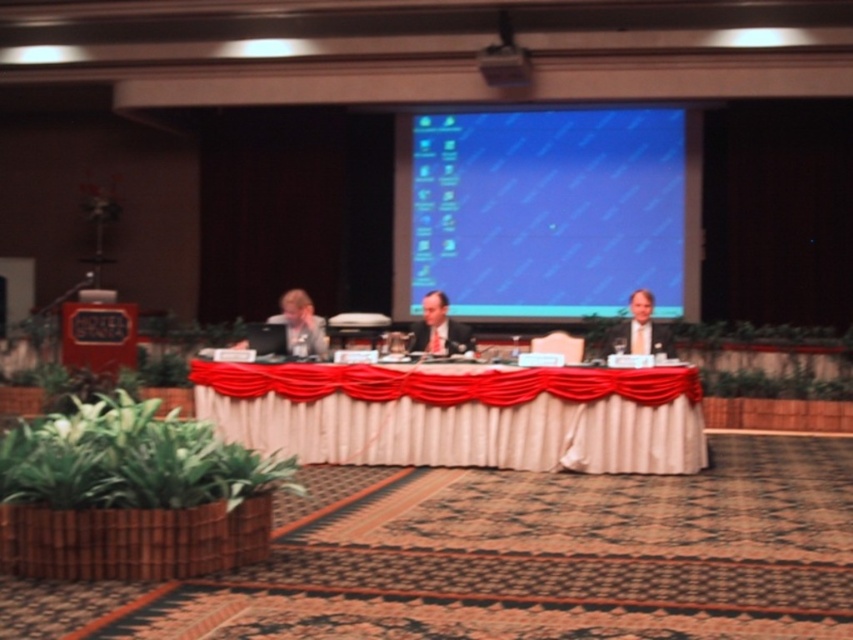
You are organizing a conference and need to place a 1.2 meter wide banner between the white satin table at center and the matte gray suit at left. Can the banner fit in the space between them based on their sizes?

The white satin table at center is wider than the matte gray suit at left. However, the banner requires 1.2 meters of space. Since the exact distance between them isn

You are an attendee at this conference and want to take a photo of the light brown hair at center without including the white satin table at center in the frame. Is this possible given their positions?

The white satin table at center is closer to the viewer than the light brown hair at center. Therefore, it would be difficult to capture the light brown hair at center without including the white satin table at center in the frame since the table is in front of it.

You are a photographer positioned at the camera location. You need to capture a closeup shot of the white satin table at center. Considering the distance, will you need to use a zoom lens to frame the subject properly?

The white satin table at center is 23.92 feet from the camera. A zoom lens would be necessary to capture a closeup shot from that distance.